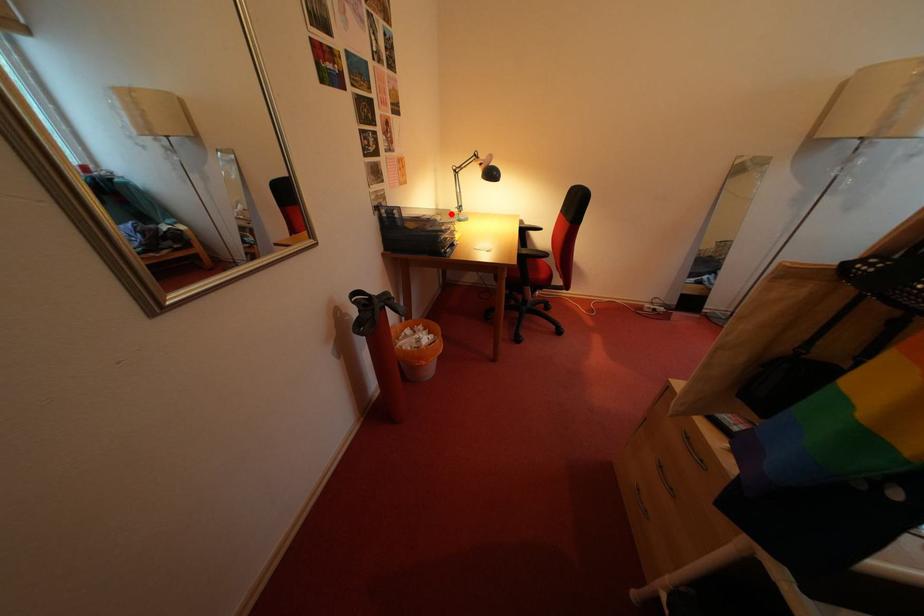
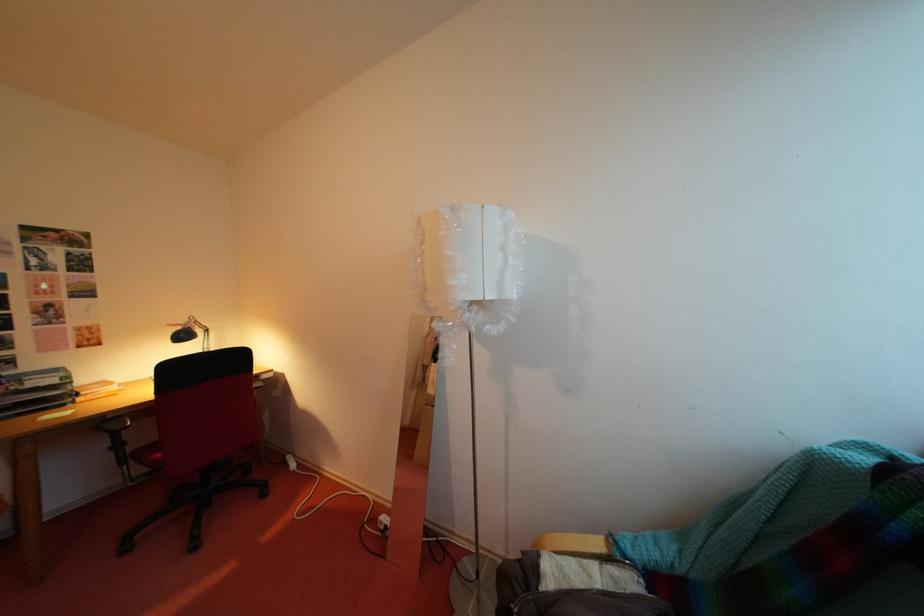
Question: I am providing you with two images of the same scene from different viewpoints. A red point is marked on the first image. At the location where the point appears in image 1, is it still visible in image 2?

Choices:
 (A) Yes
 (B) No

Answer: (B)